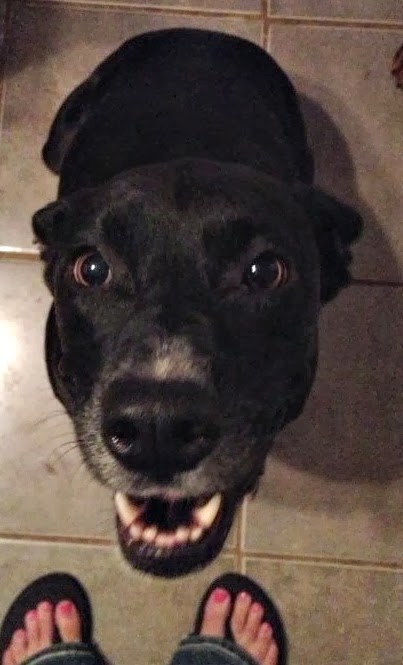
Locate an element on the screen. This screenshot has width=403, height=665. tiled floor is located at coordinates (345, 543).